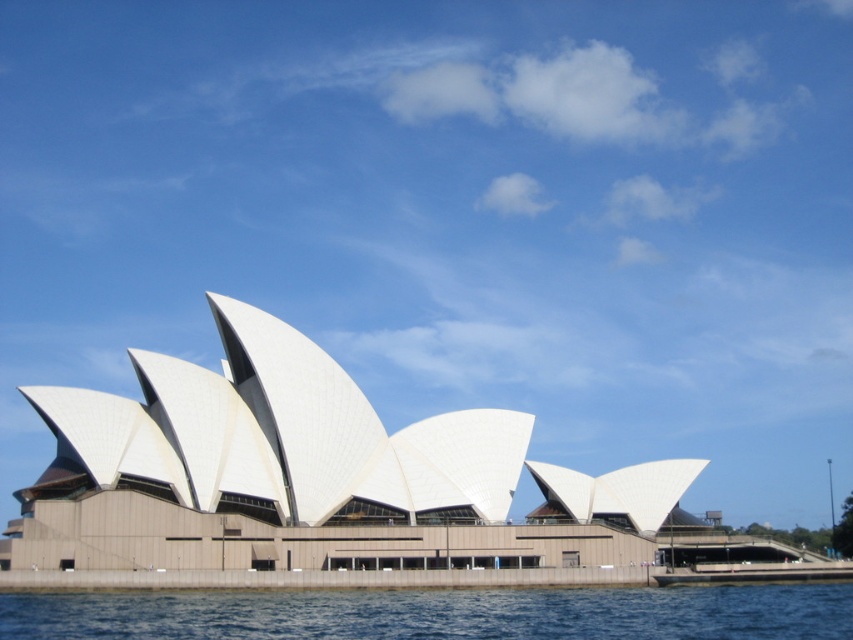
You are a photographer planning to capture the Sydney Opera House from a specific vantage point. You notice the white fabric opera house at center and the blue water at lower center in your viewfinder. Based on their sizes in the image, which object would occupy more of the frame?

The white fabric opera house at center is bigger than the blue water at lower center, so it would occupy more of the frame.

You are standing in front of the Sydney Opera House and want to take a photo that includes both the point at coordinates point (403, 456) and point (509, 602). Which point should you focus on first to ensure both are in frame?

You should focus on point (403, 456) first because it is closer to you than point (509, 602), ensuring both points remain within the camera frame.

You are a photographer positioned at the center of the scene. You want to capture a photo of the white fabric opera house at center. Based on its 2D coordinates, in which direction should you point your camera to ensure the opera house is centered in your shot?

The white fabric opera house at center is already at the center of the scene, so you should point your camera directly forward to center it in your shot.